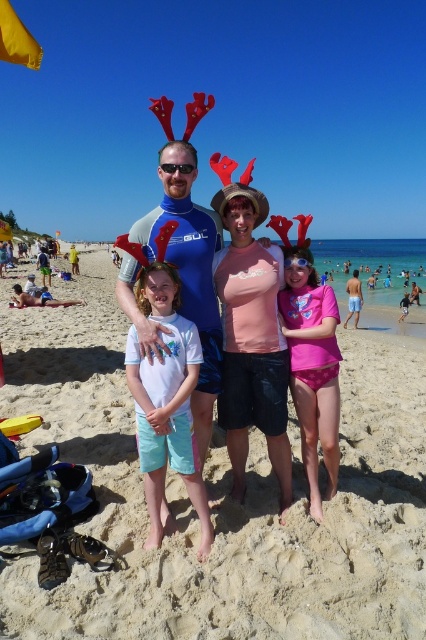
Question: Among these objects, which one is nearest to the camera?

Choices:
 (A) beige sandy beach at center
 (B) matte blue wetsuit at center
 (C) white matte t-shirt at center

Answer: (A)

Question: Does blue neoprene wetsuit at center appear on the right side of pink polka dot swimsuit at center?

Choices:
 (A) yes
 (B) no

Answer: (B)

Question: Can you confirm if matte blue wetsuit at center is positioned to the right of blue neoprene wetsuit at center?

Choices:
 (A) no
 (B) yes

Answer: (B)

Question: Which object is the closest to the pink polka dot swimsuit at center?

Choices:
 (A) matte blue wetsuit at center
 (B) blue neoprene wetsuit at center
 (C) white matte t-shirt at center

Answer: (A)

Question: Does matte blue wetsuit at center have a smaller size compared to white matte t-shirt at center?

Choices:
 (A) no
 (B) yes

Answer: (A)

Question: Which of these objects is positioned closest to the blue neoprene wetsuit at center?

Choices:
 (A) pink polka dot swimsuit at center
 (B) beige sandy beach at center
 (C) matte blue wetsuit at center
 (D) white matte t-shirt at center

Answer: (C)